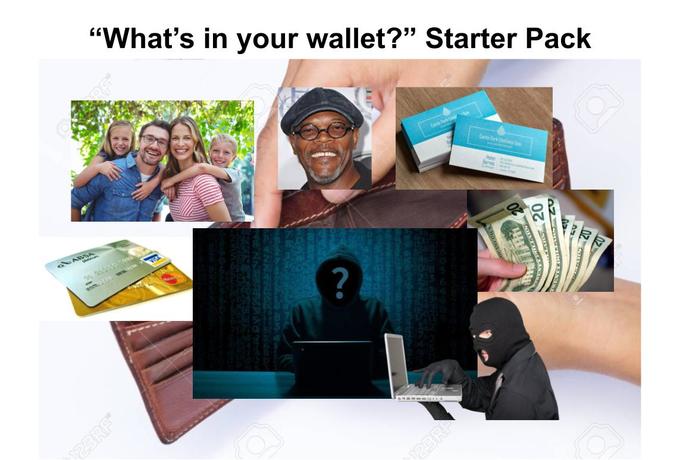
You are a GUI agent. You are given a task and a screenshot of the screen. Output one action in this format:
    pyautogui.click(x=<x>, y=<y>)
    Task: Click on the dark blue curtain
    This screenshot has width=680, height=460.
    Given the screenshot: What is the action you would take?
    pyautogui.click(x=296, y=240)